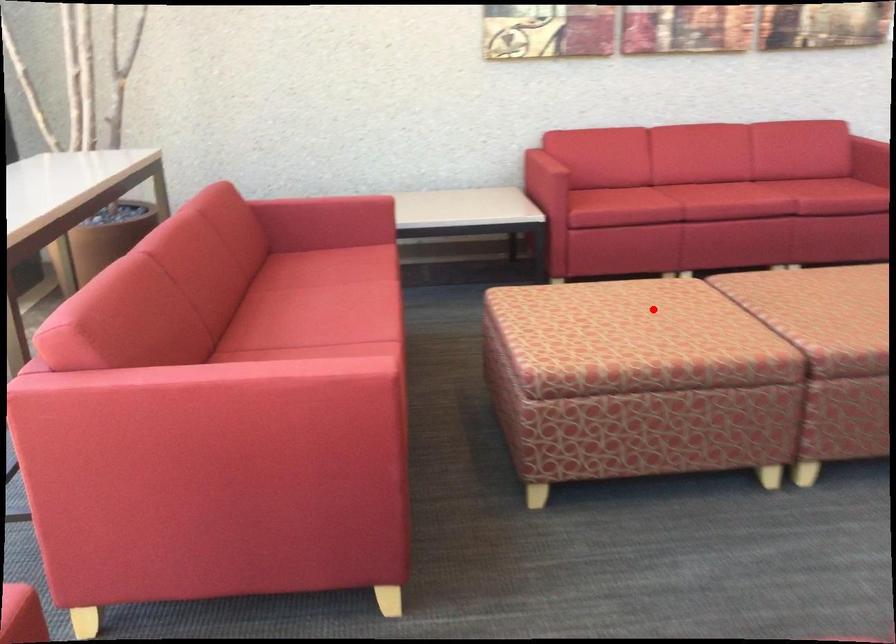
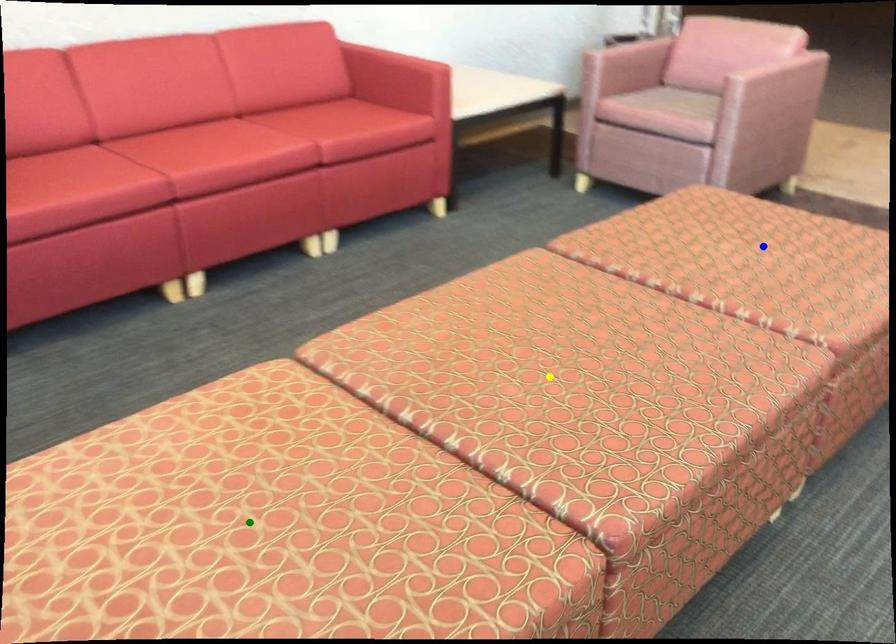
Question: I am providing you with two images of the same scene from different viewpoints. A red point is marked on the first image. You are given multiple points on the second image. Which spot in image 2 lines up with the point in image 1?

Choices:
 (A) yellow point
 (B) green point
 (C) blue point

Answer: (B)